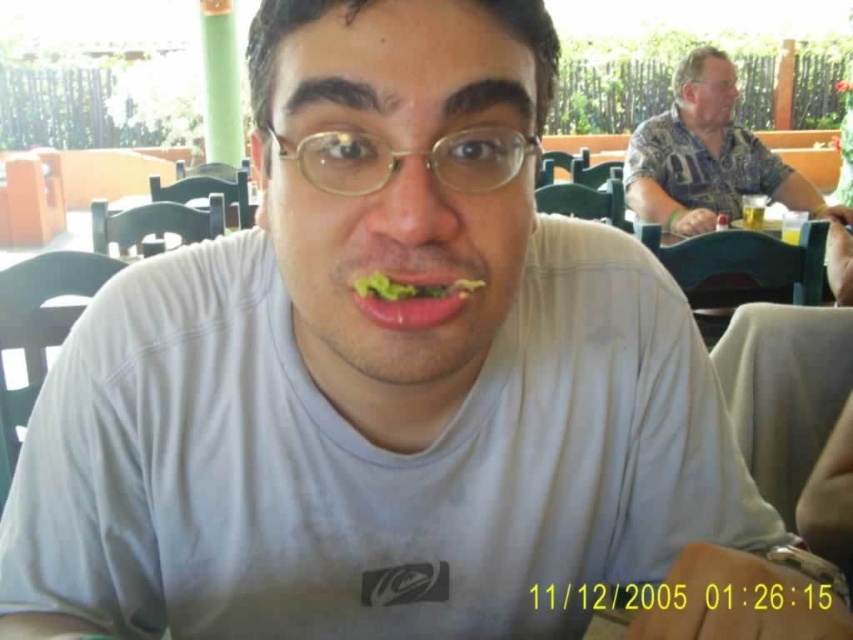
Can you confirm if hawaiian shirt at upper right is bigger than green leafy lettuce at center?

Yes.

Describe the element at coordinates (705, 156) in the screenshot. I see `hawaiian shirt at upper right` at that location.

You are a GUI agent. You are given a task and a screenshot of the screen. Output one action in this format:
    pyautogui.click(x=<x>, y=<y>)
    Task: Click on the hawaiian shirt at upper right
    
    Given the screenshot: What is the action you would take?
    pyautogui.click(x=705, y=156)

Is hawaiian shirt at upper right positioned in front of gold-framed glasses at center?

No.

Image resolution: width=853 pixels, height=640 pixels. What do you see at coordinates (705, 156) in the screenshot?
I see `hawaiian shirt at upper right` at bounding box center [705, 156].

Locate an element on the screen. The image size is (853, 640). hawaiian shirt at upper right is located at coordinates (705, 156).

Can you confirm if gold-framed glasses at center is taller than green leafy lettuce at center?

Yes, gold-framed glasses at center is taller than green leafy lettuce at center.

How distant is gold-framed glasses at center from green leafy lettuce at center?

A distance of 2.09 inches exists between gold-framed glasses at center and green leafy lettuce at center.

Who is more forward, (x=514, y=148) or (x=381, y=310)?

Point (x=381, y=310)

Find the location of a particular element. Image resolution: width=853 pixels, height=640 pixels. gold-framed glasses at center is located at coordinates (408, 156).